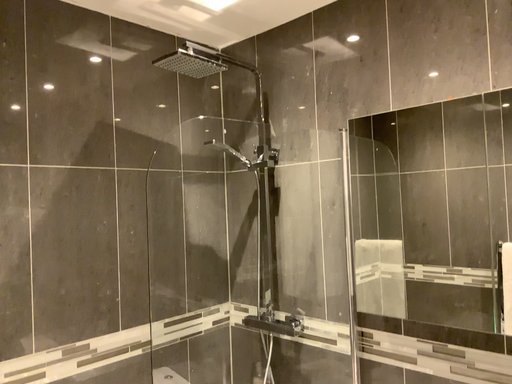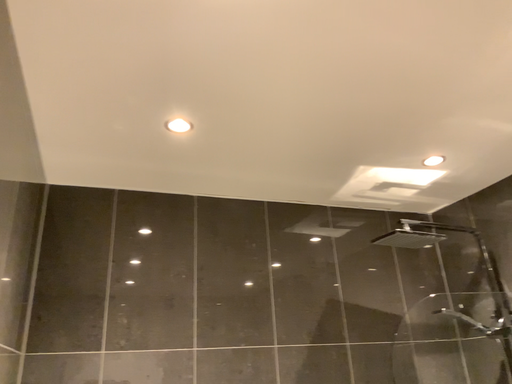
Question: Which way did the camera rotate in the video?

Choices:
 (A) rotated upward
 (B) rotated downward

Answer: (A)